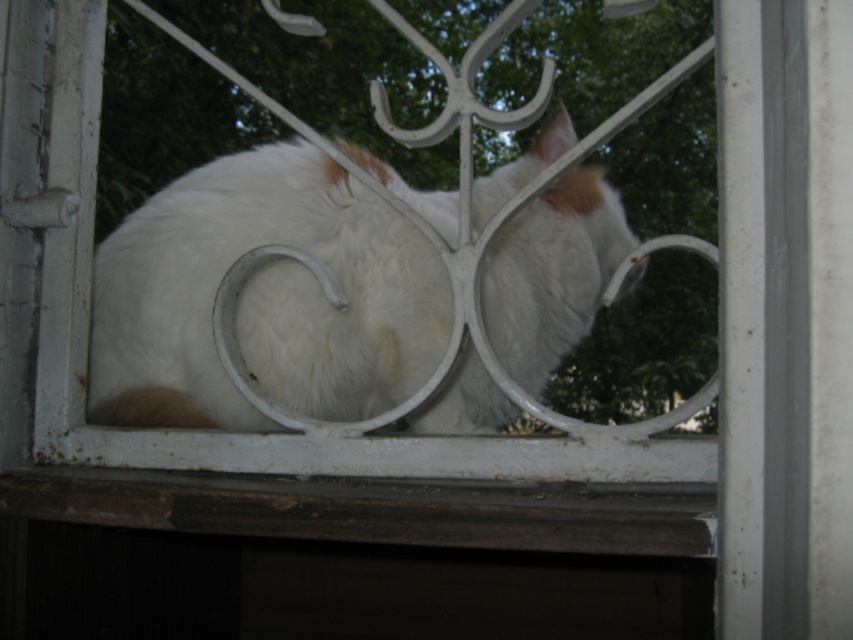
You are a photographer trying to capture the white fluffy cat at center and the brown wood at bottom in a single shot. Based on their heights, which object should you focus on first to ensure both are in frame?

The white fluffy cat at center is taller than the brown wood at bottom, so you should focus on the white fluffy cat at center first to ensure both are in frame.

Based on the coordinates provided, where is the white fluffy cat at center located in the image?

The white fluffy cat at center is located at the 2D coordinates point (263, 298).

You are a photographer trying to capture the white fluffy cat at center and the brown wood at bottom in a single frame. Based on their sizes, which object should you focus on first to ensure both fit in the frame?

The white fluffy cat at center is larger in width than the brown wood at bottom, so you should focus on ensuring the white fluffy cat at center fits first to accommodate its larger size.